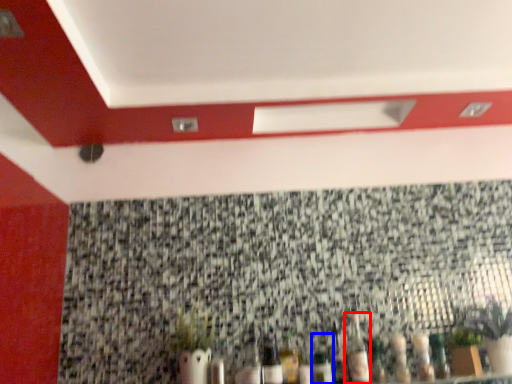
Question: Which of the following is the closest to the observer, bottle (highlighted by a red box) or bottle (highlighted by a blue box)?

Choices:
 (A) bottle
 (B) bottle

Answer: (B)